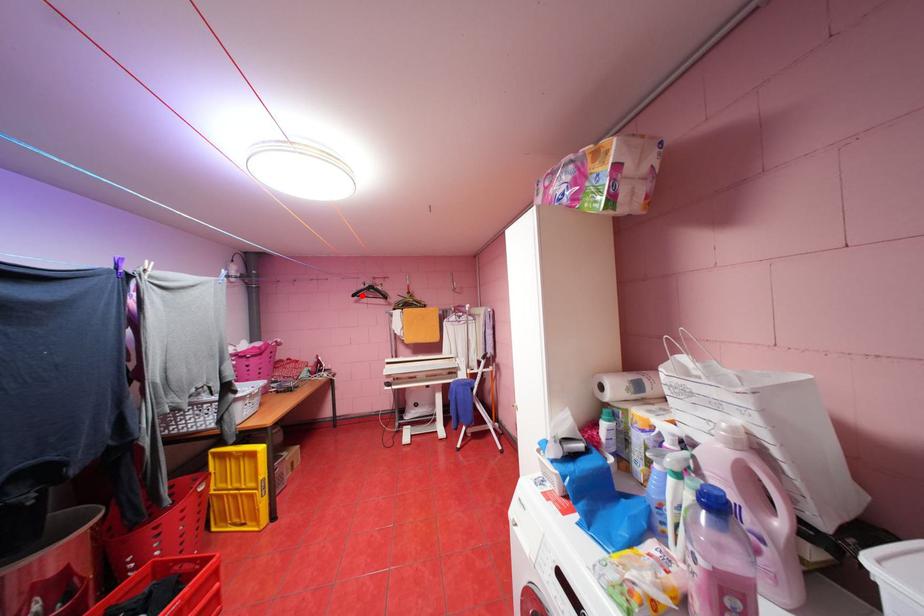
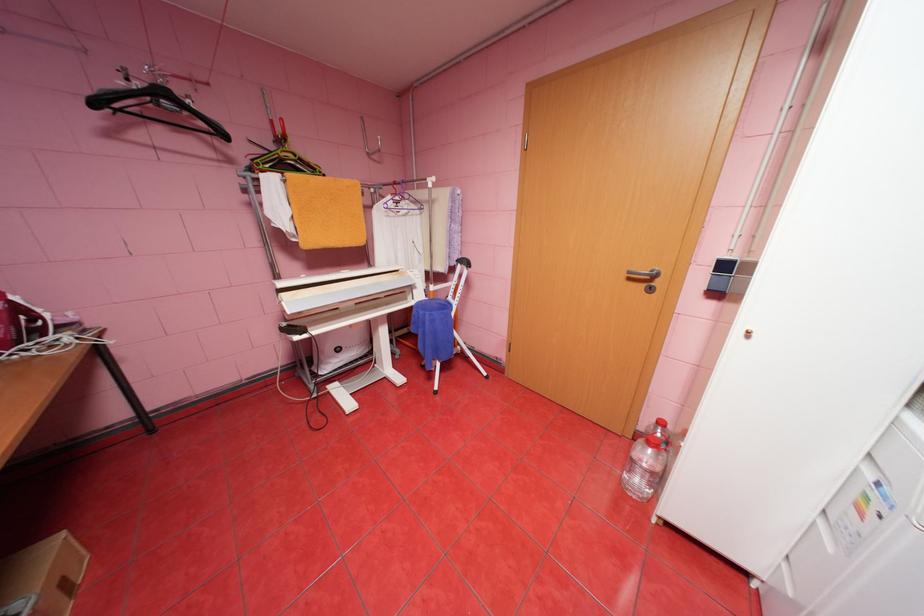
Where in the second image is the point corresponding to the highlighted location from the first image?

(103, 103)